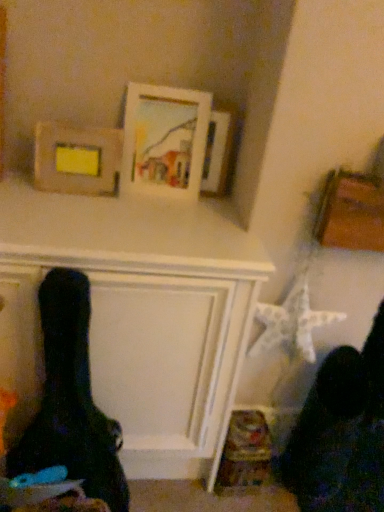
Question: From a real-world perspective, is white matte picture frame at upper center, positioned as the 2th picture frame in left-to-right order, beneath wooden frame at upper left, which appears as the 1th picture frame when viewed from the left?

Choices:
 (A) yes
 (B) no

Answer: (B)

Question: Considering the relative positions of white matte picture frame at upper center, which is the second picture frame in right-to-left order, and wooden frame at upper left, which appears as the 3th picture frame when viewed from the right, in the image provided, is white matte picture frame at upper center, which is the second picture frame in right-to-left order, to the right of wooden frame at upper left, which appears as the 3th picture frame when viewed from the right, from the viewer's perspective?

Choices:
 (A) no
 (B) yes

Answer: (B)

Question: Is white matte picture frame at upper center, which is the second picture frame in right-to-left order, positioned far away from wooden frame at upper left, which appears as the 1th picture frame when viewed from the left?

Choices:
 (A) yes
 (B) no

Answer: (B)

Question: From the image's perspective, does white matte picture frame at upper center, which is the second picture frame in right-to-left order, appear lower than wooden frame at upper left, which appears as the 3th picture frame when viewed from the right?

Choices:
 (A) no
 (B) yes

Answer: (A)

Question: Considering the relative sizes of white matte picture frame at upper center, positioned as the 2th picture frame in left-to-right order, and wooden frame at upper left, which appears as the 1th picture frame when viewed from the left, in the image provided, is white matte picture frame at upper center, positioned as the 2th picture frame in left-to-right order, bigger than wooden frame at upper left, which appears as the 1th picture frame when viewed from the left,?

Choices:
 (A) no
 (B) yes

Answer: (B)

Question: Relative to wooden picture frame at upper center, which ranks as the 1th picture frame in right-to-left order, is wooden frame at upper left, which appears as the 3th picture frame when viewed from the right, in front or behind?

Choices:
 (A) front
 (B) behind

Answer: (A)

Question: Considering the positions of wooden frame at upper left, which appears as the 1th picture frame when viewed from the left, and wooden picture frame at upper center, which ranks as the 1th picture frame in right-to-left order, in the image, is wooden frame at upper left, which appears as the 1th picture frame when viewed from the left, bigger or smaller than wooden picture frame at upper center, which ranks as the 1th picture frame in right-to-left order,?

Choices:
 (A) small
 (B) big

Answer: (B)

Question: Looking at their shapes, would you say wooden frame at upper left, which appears as the 3th picture frame when viewed from the right, is wider or thinner than wooden picture frame at upper center, the 3th picture frame in the left-to-right sequence?

Choices:
 (A) wide
 (B) thin

Answer: (A)

Question: Would you say wooden frame at upper left, which appears as the 3th picture frame when viewed from the right, is to the left or to the right of wooden picture frame at upper center, which ranks as the 1th picture frame in right-to-left order, in the picture?

Choices:
 (A) right
 (B) left

Answer: (B)

Question: From a real-world perspective, is wooden picture frame at upper center, which ranks as the 1th picture frame in right-to-left order, physically located above or below white matte picture frame at upper center, which is the second picture frame in right-to-left order?

Choices:
 (A) below
 (B) above

Answer: (A)

Question: From their relative heights in the image, would you say wooden picture frame at upper center, which ranks as the 1th picture frame in right-to-left order, is taller or shorter than white matte picture frame at upper center, positioned as the 2th picture frame in left-to-right order?

Choices:
 (A) short
 (B) tall

Answer: (A)

Question: In terms of size, does wooden picture frame at upper center, the 3th picture frame in the left-to-right sequence, appear bigger or smaller than white matte picture frame at upper center, which is the second picture frame in right-to-left order?

Choices:
 (A) big
 (B) small

Answer: (B)

Question: From the image's perspective, is wooden picture frame at upper center, the 3th picture frame in the left-to-right sequence, located above or below white matte picture frame at upper center, positioned as the 2th picture frame in left-to-right order?

Choices:
 (A) below
 (B) above

Answer: (A)

Question: Considering the positions of wooden picture frame at upper center, the 3th picture frame in the left-to-right sequence, and wooden frame at upper left, which appears as the 1th picture frame when viewed from the left, in the image, is wooden picture frame at upper center, the 3th picture frame in the left-to-right sequence, bigger or smaller than wooden frame at upper left, which appears as the 1th picture frame when viewed from the left,?

Choices:
 (A) small
 (B) big

Answer: (A)

Question: Considering the positions of wooden picture frame at upper center, which ranks as the 1th picture frame in right-to-left order, and wooden frame at upper left, which appears as the 1th picture frame when viewed from the left, in the image, is wooden picture frame at upper center, which ranks as the 1th picture frame in right-to-left order, wider or thinner than wooden frame at upper left, which appears as the 1th picture frame when viewed from the left,?

Choices:
 (A) wide
 (B) thin

Answer: (B)